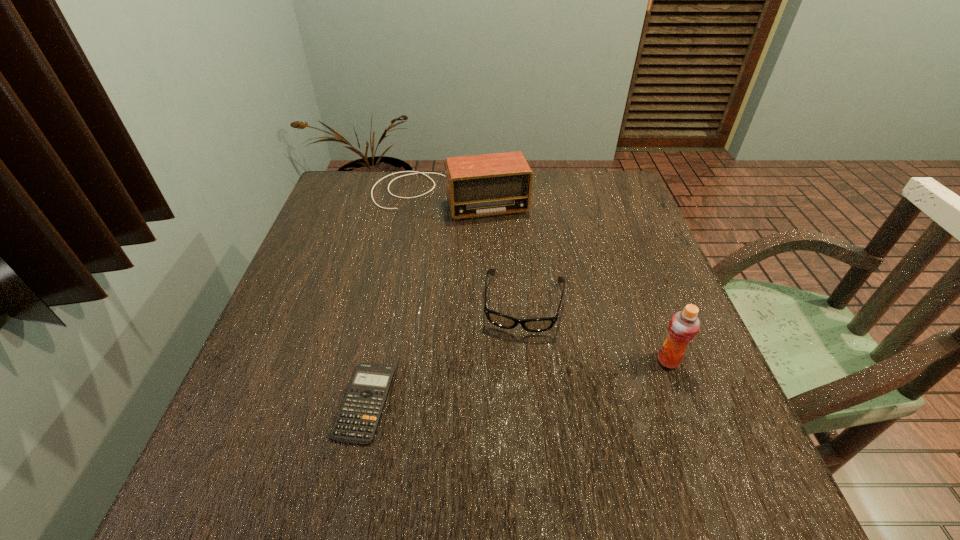
In order to click on calculator in this screenshot , I will do `click(357, 420)`.

This screenshot has height=540, width=960. In order to click on orange juice in this screenshot , I will do `click(684, 325)`.

Image resolution: width=960 pixels, height=540 pixels. I want to click on radio receiver, so click(491, 184).

Find the location of `the second shortest object`. the second shortest object is located at coordinates (500, 320).

You are a GUI agent. You are given a task and a screenshot of the screen. Output one action in this format:
    pyautogui.click(x=<x>, y=<y>)
    Task: Click on the spectacles
    Image resolution: width=960 pixels, height=540 pixels.
    Given the screenshot: What is the action you would take?
    pyautogui.click(x=500, y=320)

This screenshot has width=960, height=540. In order to click on vacant space located on the back of the shortest object in this screenshot , I will do `click(387, 302)`.

Identify the location of blank space located on the front of the rightmost object. The width and height of the screenshot is (960, 540). (700, 444).

Locate an element on the screen. This screenshot has height=540, width=960. free space located on the front-facing side of the farthest object is located at coordinates (468, 246).

The height and width of the screenshot is (540, 960). Find the location of `free space located 0.100m on the front-facing side of the farthest object`. free space located 0.100m on the front-facing side of the farthest object is located at coordinates (468, 244).

Locate an element on the screen. This screenshot has height=540, width=960. vacant point located 0.330m on the front-facing side of the farthest object is located at coordinates (483, 307).